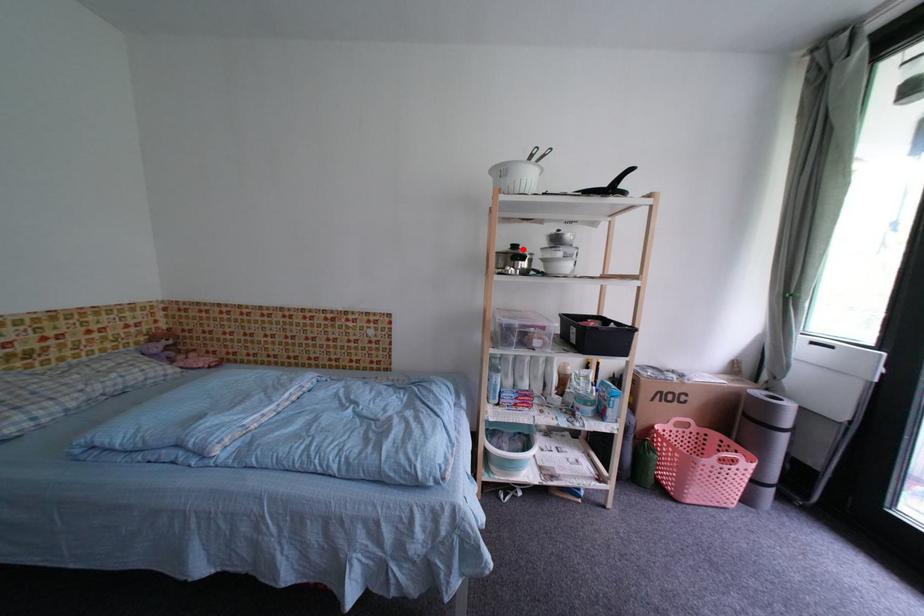
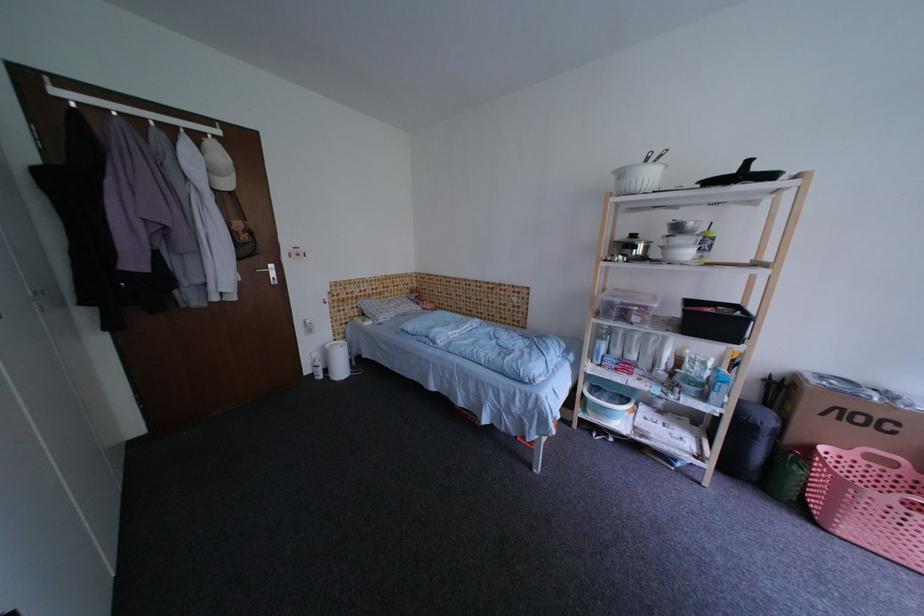
In the second image, find the point that corresponds to the highlighted location in the first image.

(641, 238)